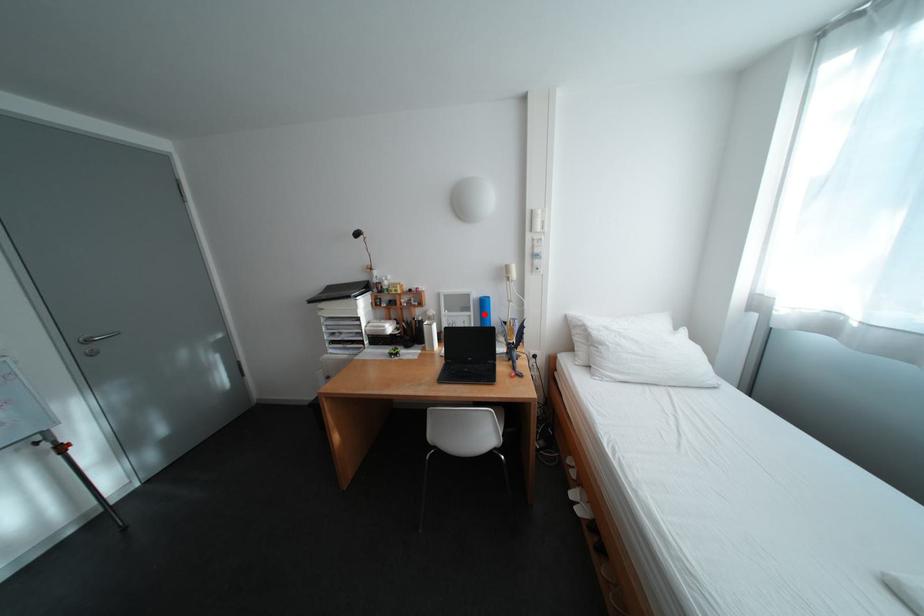
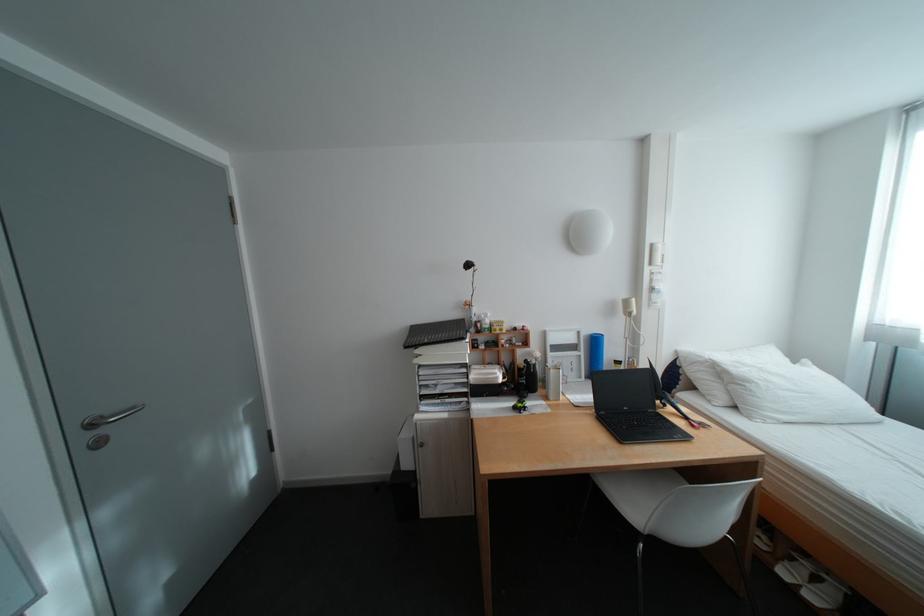
Locate, in the second image, the point that corresponds to the highlighted location in the first image.

(594, 354)